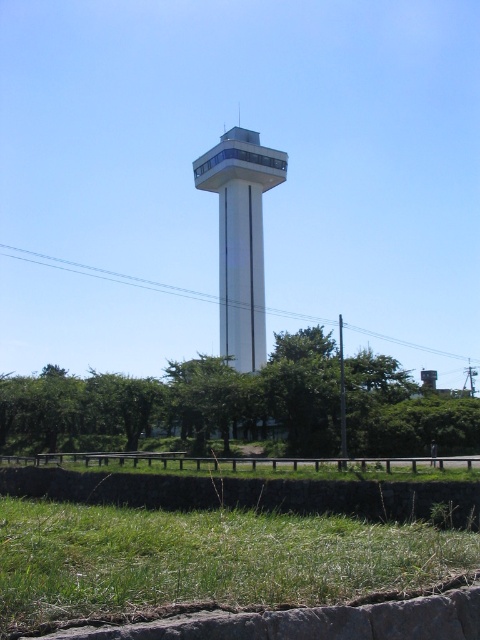
You are standing on the grassy area in front of the white smooth tower at center. You want to take a photo of the tower with the green leafy tree at center in the background. Will the tree be fully visible behind the tower in your photo?

The green leafy tree at center is shorter than the white smooth tower at center, so the tree will be fully visible behind the tower in the photo.

You are standing at the base of the tall, white observation tower and want to take a photo of the green leafy tree at center. Based on its coordinates, in which direction relative to the tower should you position yourself to capture the tree in the frame?

The green leafy tree at center is located at coordinates point (181, 403). Since the coordinates are in the lower right section of the image, you should position yourself to the right and slightly forward of the tower to capture the tree in the frame.